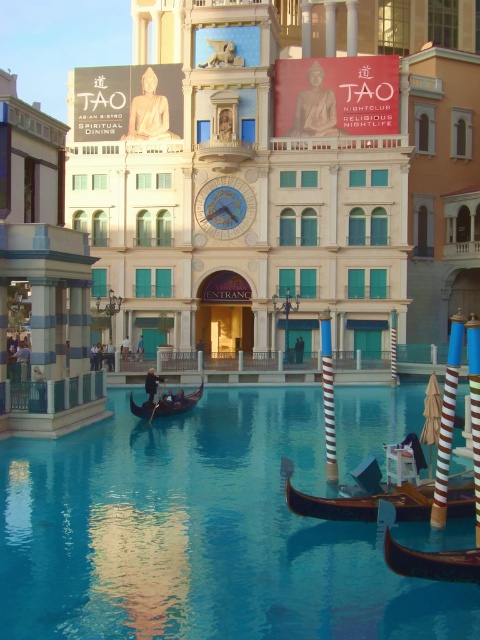
You are standing at the entrance of the grand building and want to take a photo of the wooden gondola at lower right and the striped wood pole at right. Which object should you position to your left side to capture both in the frame?

You should position the striped wood pole at right to your left side because the wooden gondola at lower right is to the left of striped wood pole at right. This way, both objects will be included in your photo frame.

You are a delivery person who needs to deliver a package to the entrance of the grand building. You have a long pole that is exactly the same height as the striped wood pole at right. If you need to carry this pole horizontally through the blue polished water at center, will it fit without touching the water?

The blue polished water at center is shorter than the striped wood pole at right. Since the pole is as tall as the striped wood pole at right, it will extend below the water level when carried horizontally, so it will touch the water.